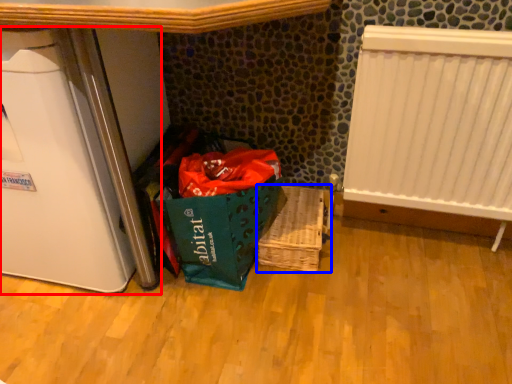
Question: Which object is further to the camera taking this photo, appliance (highlighted by a red box) or basket (highlighted by a blue box)?

Choices:
 (A) appliance
 (B) basket

Answer: (B)